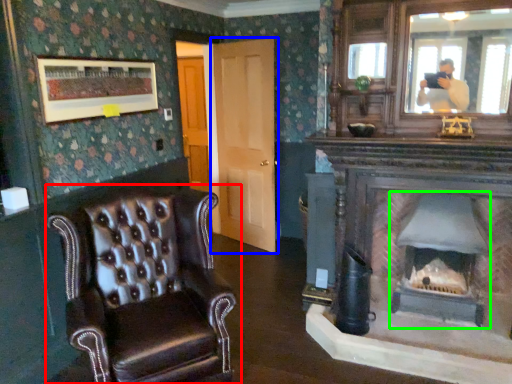
Question: Which object is positioned closest to chair (highlighted by a red box)? Select from door (highlighted by a blue box) and fireplace (highlighted by a green box).

Choices:
 (A) door
 (B) fireplace

Answer: (B)